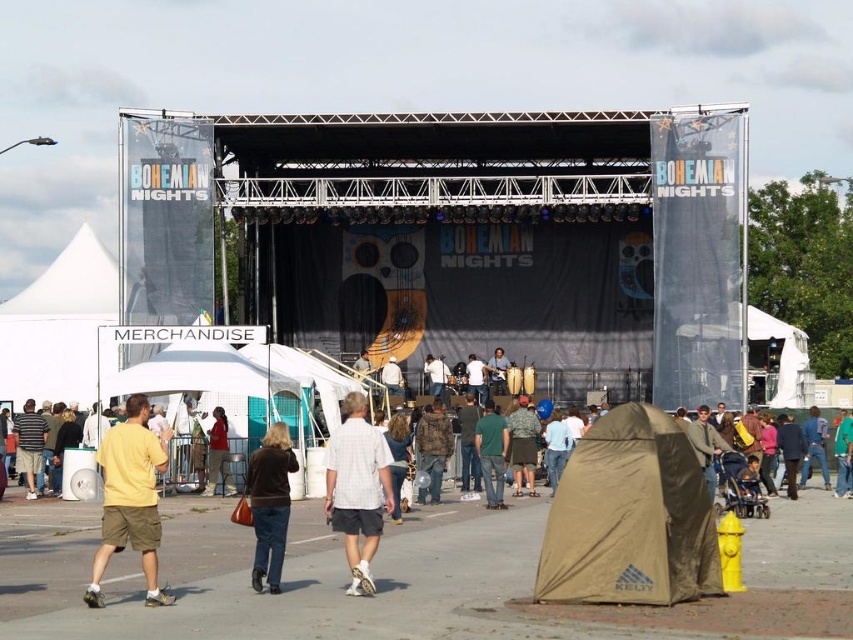
You are standing at the center of the image. Which object from the following is located at the lower right? Please choose from the options below. A. The stage. B. The merchandise booth. C. The blue denim jeans at lower right.

C. The blue denim jeans at lower right is located at the lower right as per the 2D coordinates provided in the description.

You are setting up a temporary tent for an event and need to know which object is wider. You see the white fabric canopy at left and the green matte shirt at center. Which one is wider?

A: The white fabric canopy at left is wider than the green matte shirt at center.

You are a photographer at the event and need to capture a photo that includes both the yellow cotton shirt at lower left and the camouflage fabric shorts at center. Which of the two should you focus on first to ensure they are both in frame?

The yellow cotton shirt at lower left is taller than the camouflage fabric shorts at center, so focusing on the taller object first will help ensure both are in frame.